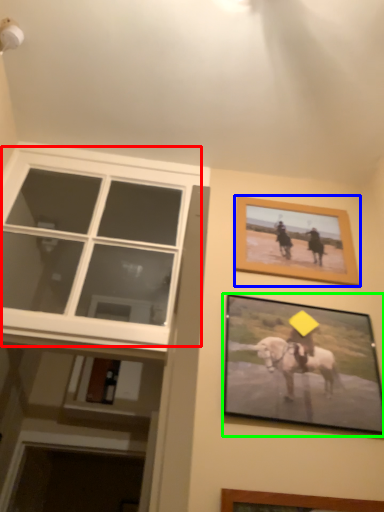
Question: Which is farther away from window (highlighted by a red box)? picture frame (highlighted by a blue box) or picture frame (highlighted by a green box)?

Choices:
 (A) picture frame
 (B) picture frame

Answer: (B)